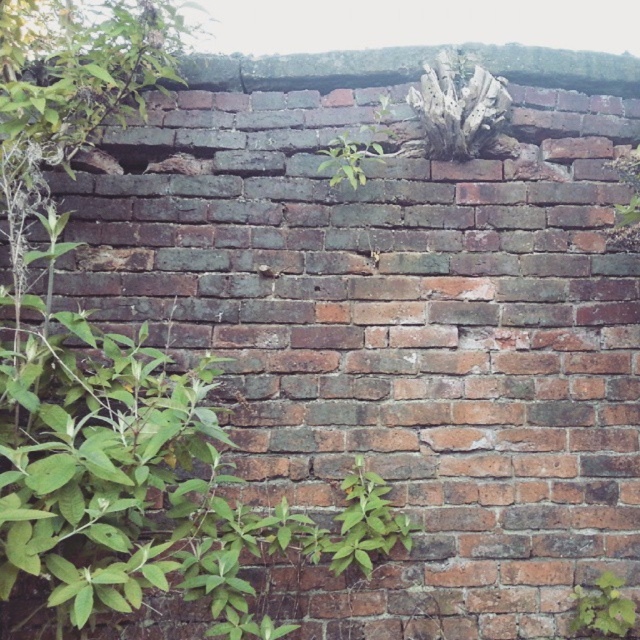
Question: Does green leafy plant at lower right appear over green leafy plant at center?

Choices:
 (A) yes
 (B) no

Answer: (B)

Question: Among these points, which one is farthest from the camera?

Choices:
 (A) (589, 625)
 (B) (336, 170)

Answer: (B)

Question: Does green leafy plant at lower right come in front of green leafy plant at center?

Choices:
 (A) no
 (B) yes

Answer: (B)

Question: Does green leafy plant at lower right come behind green leafy plant at center?

Choices:
 (A) no
 (B) yes

Answer: (A)

Question: Which point is farther from the camera taking this photo?

Choices:
 (A) (584, 621)
 (B) (328, 176)

Answer: (B)